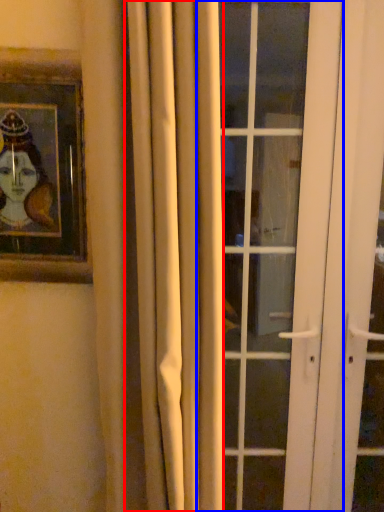
Question: Which point is further to the camera, curtain (highlighted by a red box) or door (highlighted by a blue box)?

Choices:
 (A) curtain
 (B) door

Answer: (B)